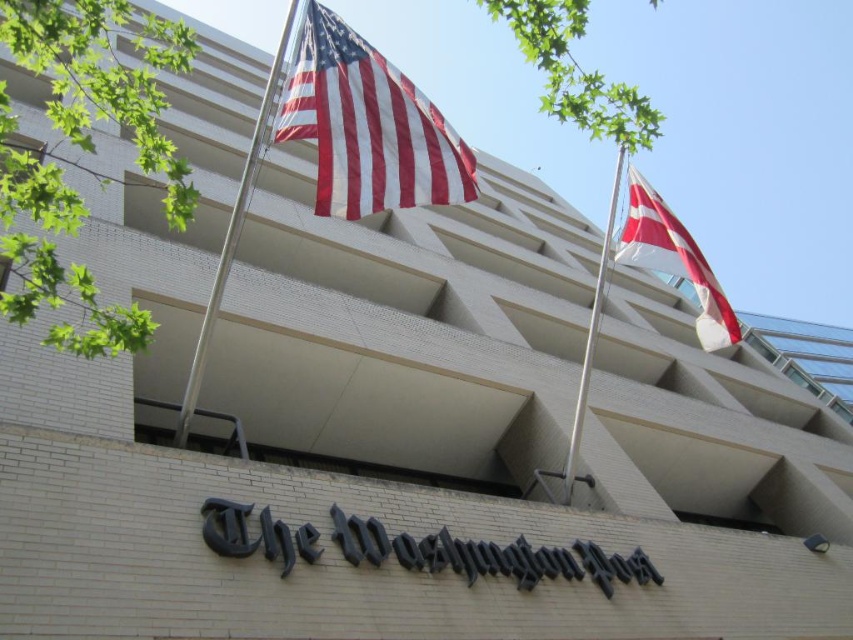
You are standing in front of the building and want to determine the relative positions of two points marked on its facade. Which point is closer to you, point (219, 298) or point (592, 308)?

Point (219, 298) is closer to the viewer than point (592, 308).

You are standing at the entrance of the building and want to take a photo of both the metallic silver flag pole at upper center and the silver metallic flag pole at right. Which flag pole is closer to the entrance?

The silver metallic flag pole at right is closer to the entrance because the metallic silver flag pole at upper center is positioned over it, meaning it is further away from the entrance.